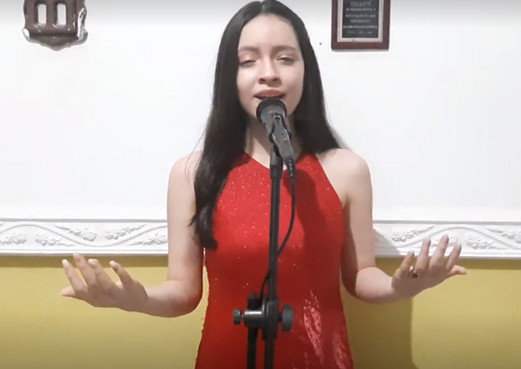
Find the location of a particular element. bottom border of plaque is located at coordinates (356, 41).